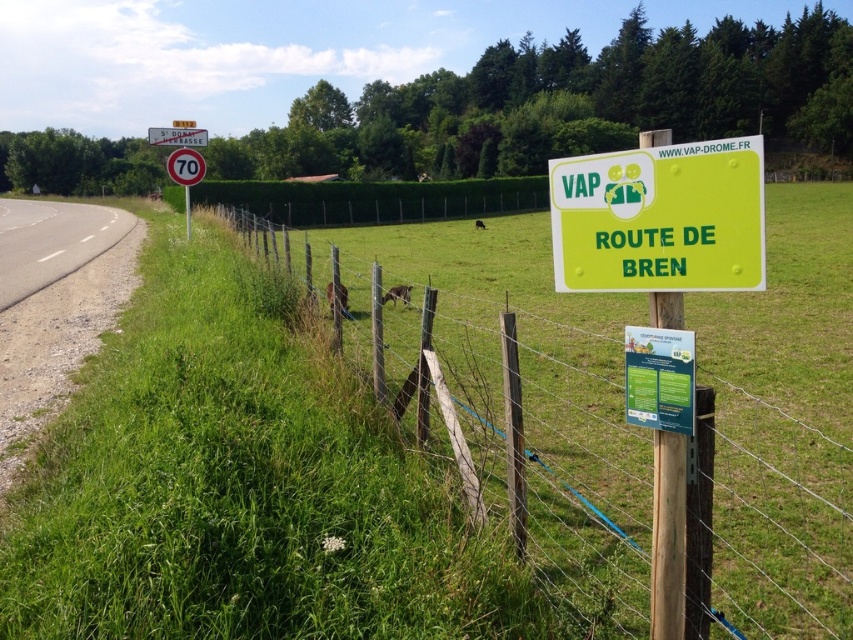
Question: Which object is farther from the camera taking this photo?

Choices:
 (A) wooden post at center
 (B) green plastic sign at center-right

Answer: (A)

Question: Is green plastic sign at center-right thinner than metallic red sign at upper center?

Choices:
 (A) yes
 (B) no

Answer: (A)

Question: Can you confirm if wooden post at center is positioned to the left of green plastic sign at center-right?

Choices:
 (A) no
 (B) yes

Answer: (B)

Question: Which of the following is the farthest from the observer?

Choices:
 (A) metallic red sign at upper center
 (B) green plastic sign at center-right
 (C) wooden post at center

Answer: (A)

Question: Which point is closer to the camera?

Choices:
 (A) wooden post at center
 (B) metallic red sign at upper center
 (C) green plastic sign at center-right

Answer: (C)

Question: Does wooden post at center have a lesser width compared to green plastic sign at center-right?

Choices:
 (A) yes
 (B) no

Answer: (B)